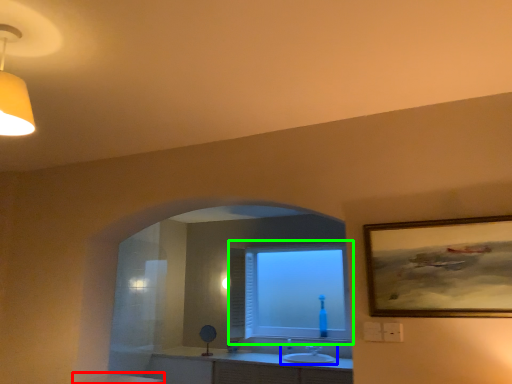
Question: Which object is positioned closest to counter top (highlighted by a red box)? Select from sink (highlighted by a blue box) and window (highlighted by a green box).

Choices:
 (A) sink
 (B) window

Answer: (A)